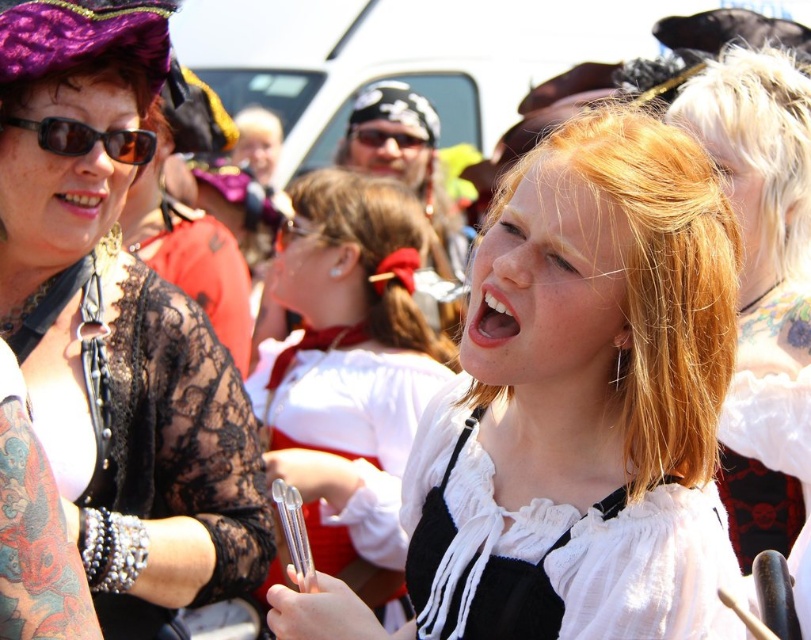
You are standing in the center of the festival crowd and need to locate the white satin blouse at center. According to the coordinates provided, where exactly should you look to find it?

The white satin blouse at center is located at point 0.572 on the x axis and 0.433 on the y axis.